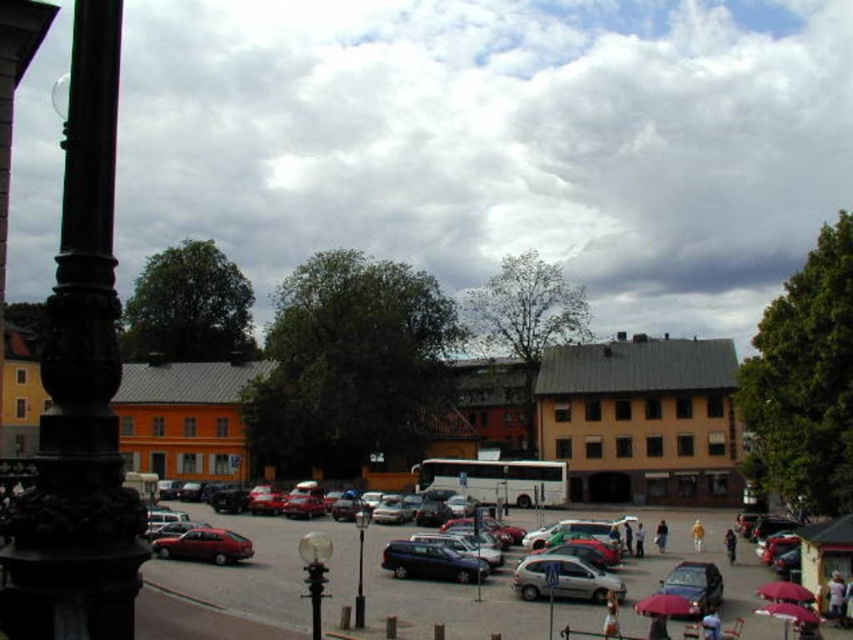
Identify the location of metallic blue sedan at lower right. This screenshot has height=640, width=853. (694, 586).

Looking at this image, is metallic blue sedan at lower right closer to the viewer compared to matte red umbrella at lower right?

Yes.

The image size is (853, 640). Describe the element at coordinates (694, 586) in the screenshot. I see `metallic blue sedan at lower right` at that location.

Find the location of a particular element. metallic blue sedan at lower right is located at coordinates (694, 586).

Does red fabric umbrella at center have a lesser height compared to brown leather jacket at center?

No, red fabric umbrella at center is not shorter than brown leather jacket at center.

This screenshot has width=853, height=640. Identify the location of red fabric umbrella at center. (665, 605).

Locate an element on the screen. red fabric umbrella at center is located at coordinates (665, 605).

Find the location of a particular element. brown leather jacket at center is located at coordinates coord(660,536).

Who is positioned more to the left, brown leather jacket at center or orange leather jacket at center?

From the viewer's perspective, brown leather jacket at center appears more on the left side.

Who is more forward, [662,545] or [694,538]?

Point [662,545] is more forward.

The image size is (853, 640). In order to click on brown leather jacket at center in this screenshot , I will do `click(660, 536)`.